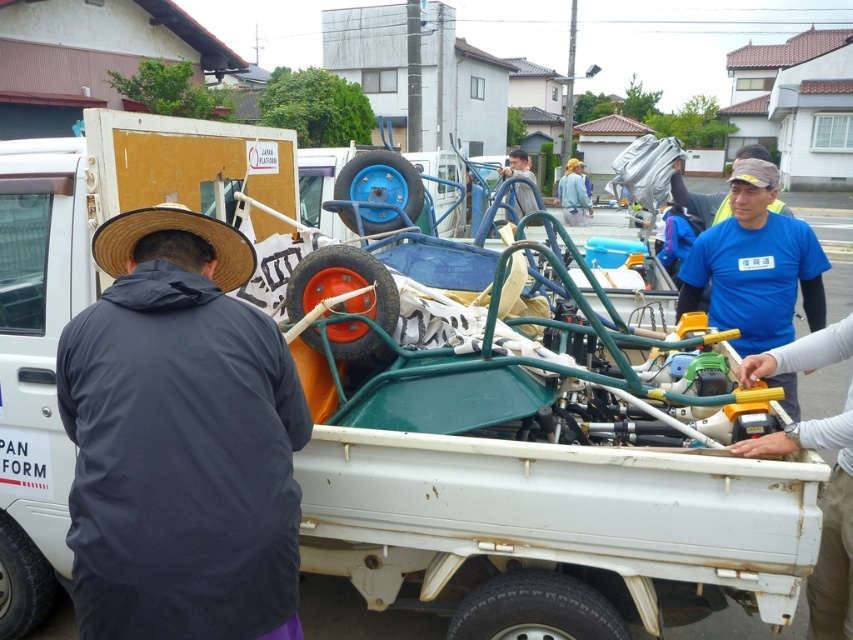
Question: Among these points, which one is nearest to the camera?

Choices:
 (A) (521, 150)
 (B) (364, 600)
 (C) (578, 163)
 (D) (833, 577)

Answer: (D)

Question: From the image, what is the correct spatial relationship of dark gray fabric hat at left in relation to light gray fabric shirt at center?

Choices:
 (A) left
 (B) right

Answer: (A)

Question: Does green metallic cart at center appear on the right side of blue fabric shirt at center?

Choices:
 (A) no
 (B) yes

Answer: (A)

Question: Which of the following is the farthest from the observer?

Choices:
 (A) white plastic bag at right
 (B) light gray fabric shirt at center

Answer: (B)

Question: Which is nearer to the blue fabric shirt at center?

Choices:
 (A) light gray fabric shirt at center
 (B) green metallic cart at center
 (C) dark gray fabric hat at left

Answer: (B)

Question: From the image, what is the correct spatial relationship of dark gray fabric hat at left in relation to white plastic bag at right?

Choices:
 (A) right
 (B) left

Answer: (B)